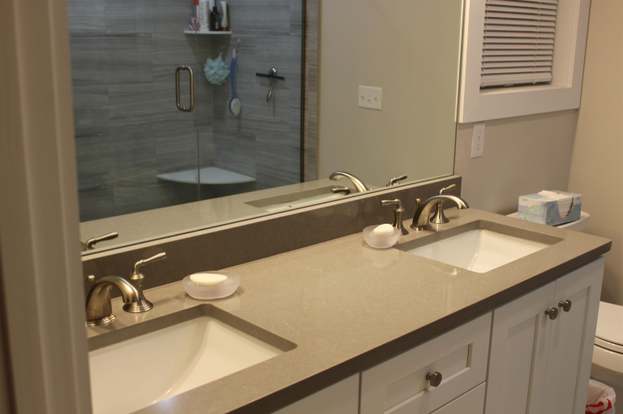
Image resolution: width=623 pixels, height=414 pixels. I want to click on toilet seat, so click(615, 347).